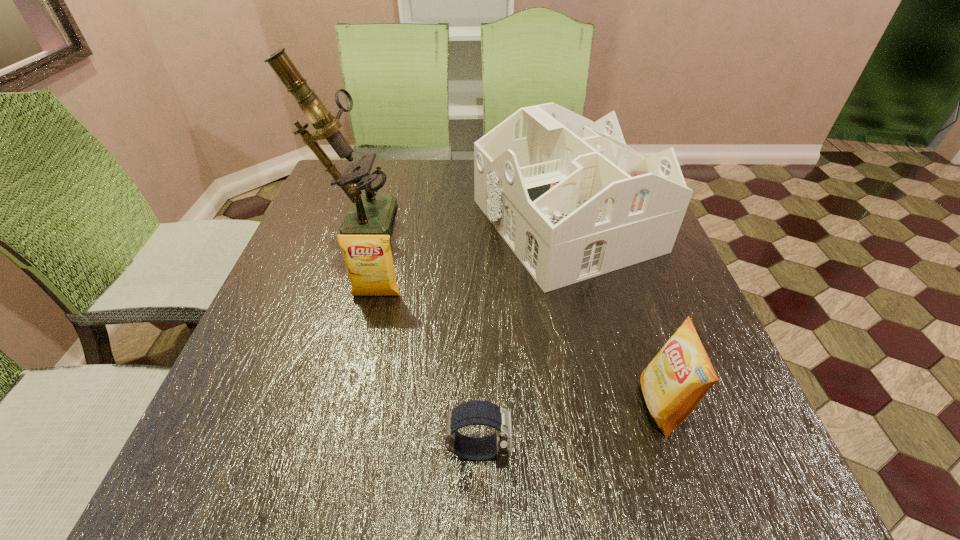
This screenshot has width=960, height=540. I want to click on microscope, so click(x=368, y=214).

The image size is (960, 540). Identify the location of dollhouse. (569, 197).

At what (x,y) coordinates should I click in order to perform the action: click on the farther crisp (potato chip). Please return your answer as a coordinate pair (x, y). The width and height of the screenshot is (960, 540). Looking at the image, I should click on (368, 258).

Identify the location of the right crisp (potato chip). Image resolution: width=960 pixels, height=540 pixels. (676, 380).

Locate an element on the screen. This screenshot has height=540, width=960. the shortest object is located at coordinates (477, 412).

Image resolution: width=960 pixels, height=540 pixels. Find the location of `blank area located 0.230m at the eyepiece of the microscope`. blank area located 0.230m at the eyepiece of the microscope is located at coordinates (482, 215).

Identify the location of free space located 0.340m on the left of the second tallest object. (342, 224).

The image size is (960, 540). I want to click on vacant region located 0.340m on the front of the farther crisp (potato chip) with the logo, so click(337, 460).

Locate an element on the screen. The image size is (960, 540). free space located on the front-facing side of the nearer crisp (potato chip) is located at coordinates [577, 406].

Identify the location of vacant space situated on the front-facing side of the nearer crisp (potato chip). (530, 406).